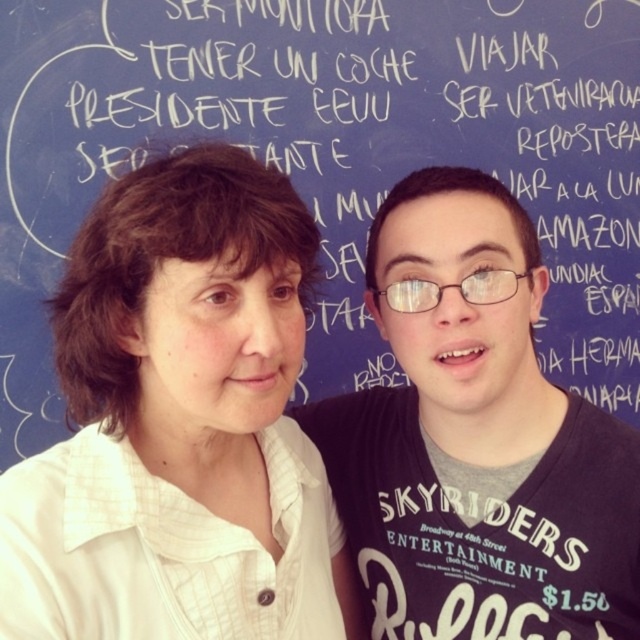
You are a photographer standing at the front of the blue wall with two people in the scene. You want to take a photo that includes both the point at position [216,188] and the point at position [369,513]. Based on their positions, which point should appear closer to the camera in the final photo?

Point [216,188] is in front of point [369,513], so it will appear closer to the camera in the photo.

You are a photographer setting up for a group photo. You have two shirts in the scene, the white textured shirt at upper left and the dark gray cotton shirt at center. Which shirt should you focus on to ensure it appears larger in the photo?

The white textured shirt at upper left is much taller than the dark gray cotton shirt at center, so focusing on the white textured shirt at upper left will make it appear larger in the photo.